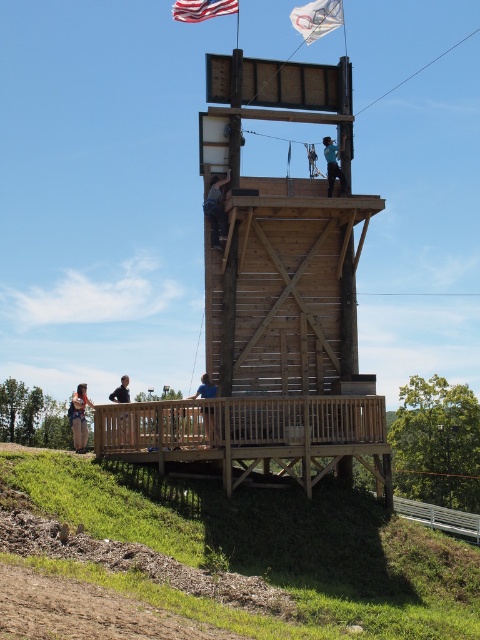
You are a visitor at the observation tower. You notice the white plastic flag at upper center and the denim jacket at lower left. Which object is larger in size?

The white plastic flag at upper center is bigger than the denim jacket at lower left.